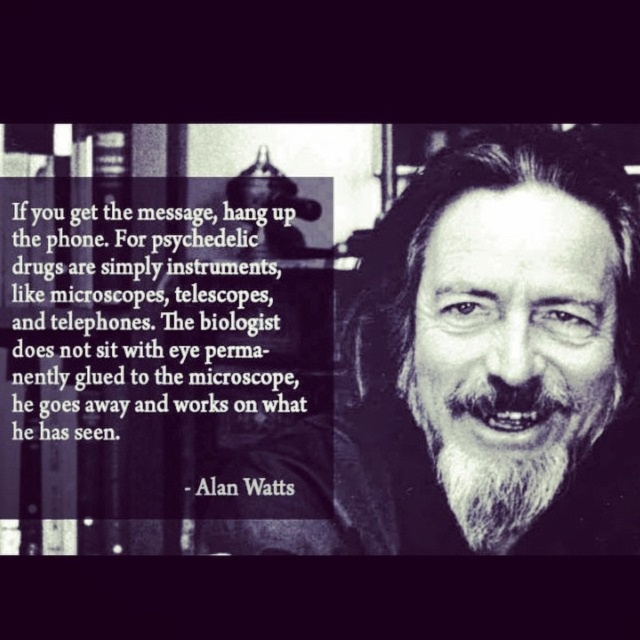
Question: Does white beard at right appear on the right side of white fuzzy beard at center?

Choices:
 (A) yes
 (B) no

Answer: (B)

Question: Is white beard at right further to the viewer compared to white fuzzy beard at center?

Choices:
 (A) no
 (B) yes

Answer: (A)

Question: Which point is farther from the camera taking this photo?

Choices:
 (A) [509, 417]
 (B) [61, 300]

Answer: (B)

Question: Does white beard at right appear over black paper at upper left?

Choices:
 (A) yes
 (B) no

Answer: (B)

Question: Which object is positioned closest to the black paper at upper left?

Choices:
 (A) white fuzzy beard at center
 (B) white beard at right

Answer: (B)

Question: Which object is farther from the camera taking this photo?

Choices:
 (A) white fuzzy beard at center
 (B) black paper at upper left

Answer: (B)